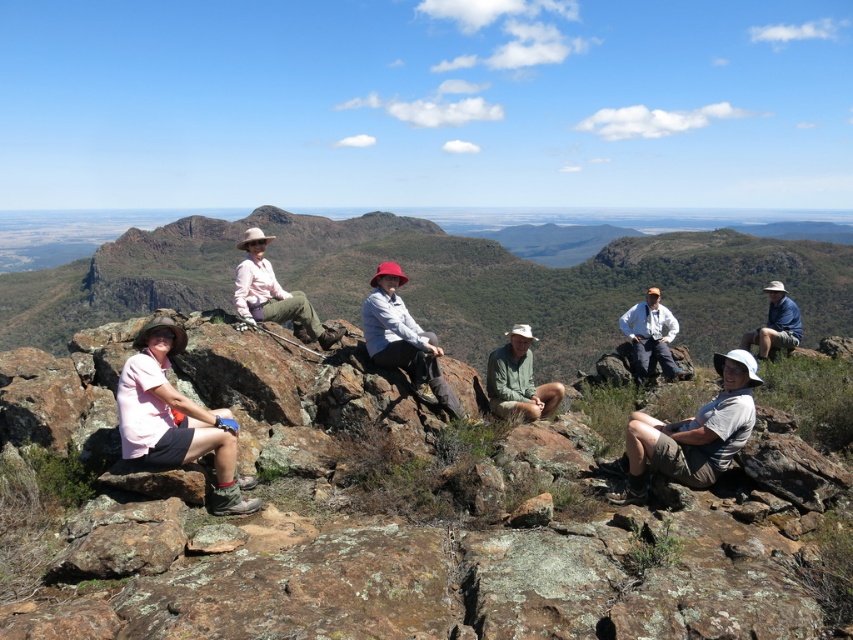
Is rugged rock formation at center further to camera compared to gray fabric hat at lower right?

Yes, rugged rock formation at center is behind gray fabric hat at lower right.

In the scene shown: Which of these two, rugged rock formation at center or gray fabric hat at lower right, stands shorter?

With less height is gray fabric hat at lower right.

Locate an element on the screen. The image size is (853, 640). rugged rock formation at center is located at coordinates (436, 280).

Does pink fabric shirt at left have a larger size compared to matte gray hat at center?

No, pink fabric shirt at left is not bigger than matte gray hat at center.

Does pink fabric shirt at left lie in front of matte gray hat at center?

Yes.

Does point (184, 435) come in front of point (379, 310)?

That is True.

Identify the location of pink fabric shirt at left. [x=175, y=419].

Between point (372, 360) and point (782, 342), which one is positioned in front?

Positioned in front is point (372, 360).

Between point (434, 396) and point (773, 339), which one is positioned behind?

The point (773, 339) is more distant.

Is point (424, 365) positioned behind point (763, 348)?

No, (424, 365) is in front of (763, 348).

Locate an element on the screen. matte gray hat at center is located at coordinates (403, 337).